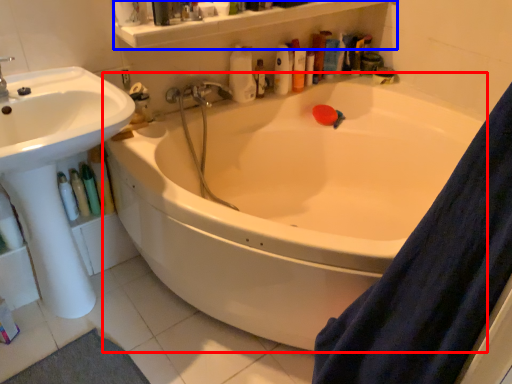
Question: Which object appears farthest to the camera in this image, bathtub (highlighted by a red box) or balustrade (highlighted by a blue box)?

Choices:
 (A) bathtub
 (B) balustrade

Answer: (B)